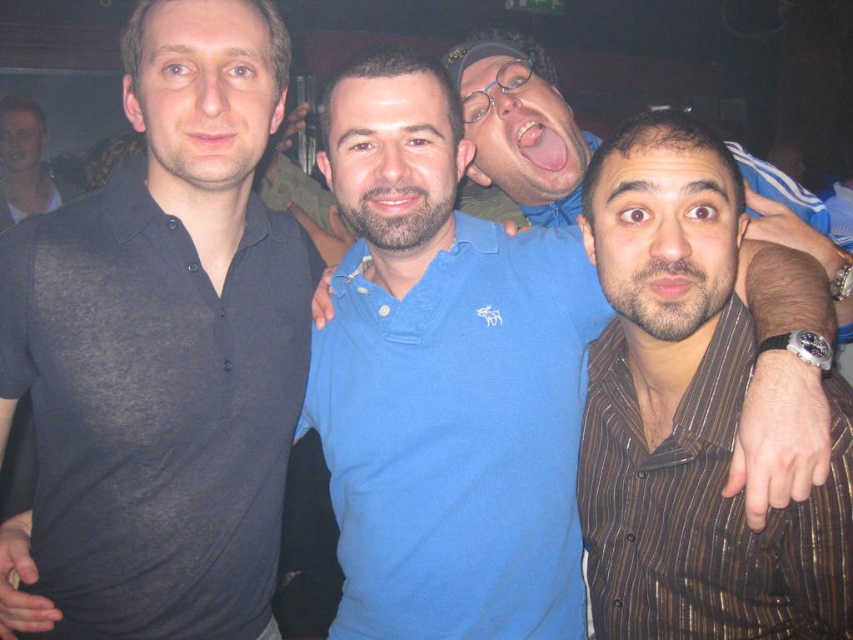
You are a photographer adjusting the lighting for a group photo. You notice the dark gray sheer shirt at left and the blue cotton polo shirt at center. Which of these two shirts should you focus your spotlight on to ensure the subject wearing it is well lit, considering their height difference?

The dark gray sheer shirt at left is taller than the blue cotton polo shirt at center, so you should focus the spotlight on the dark gray sheer shirt at left to ensure proper lighting for its wearer.

You are trying to identify the order of the men from left to right based on their clothing. Which man is standing to the left of the other between the dark gray sheer shirt at left and brown striped shirt at center?

The dark gray sheer shirt at left is positioned on the left side of brown striped shirt at center, so the dark gray sheer shirt at left is to the left of the brown striped shirt at center.